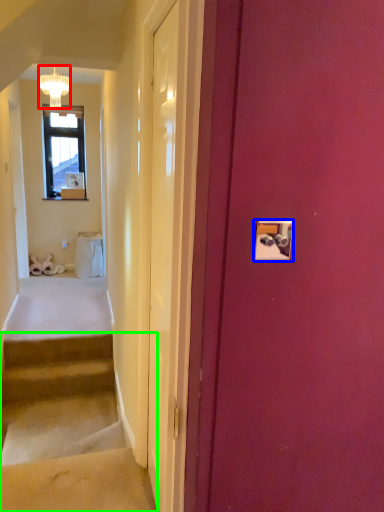
Question: Considering the real-world distances, which object is farthest from lamp (highlighted by a red box)? light switch (highlighted by a blue box) or stairs (highlighted by a green box)?

Choices:
 (A) light switch
 (B) stairs

Answer: (B)